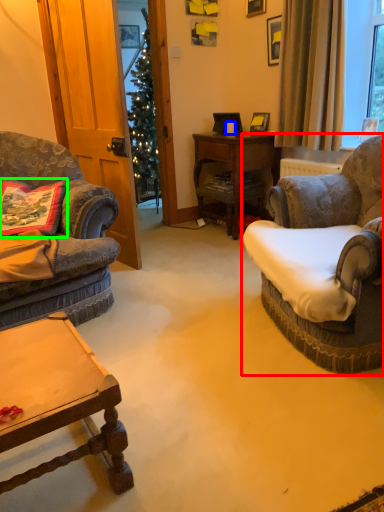
Question: Which object is positioned closest to chair (highlighted by a red box)? Select from coffee cup (highlighted by a blue box) and pillow (highlighted by a green box).

Choices:
 (A) coffee cup
 (B) pillow

Answer: (B)